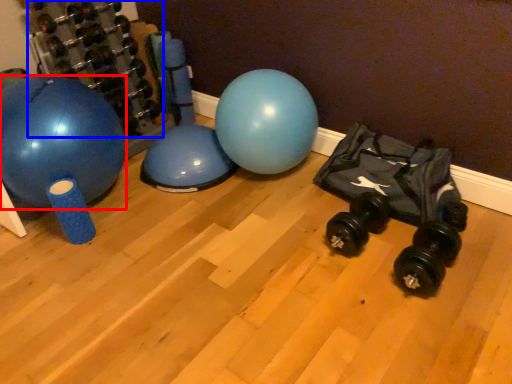
Question: Which of the following is the farthest to the observer, ball (highlighted by a red box) or dumbbell (highlighted by a blue box)?

Choices:
 (A) ball
 (B) dumbbell

Answer: (B)